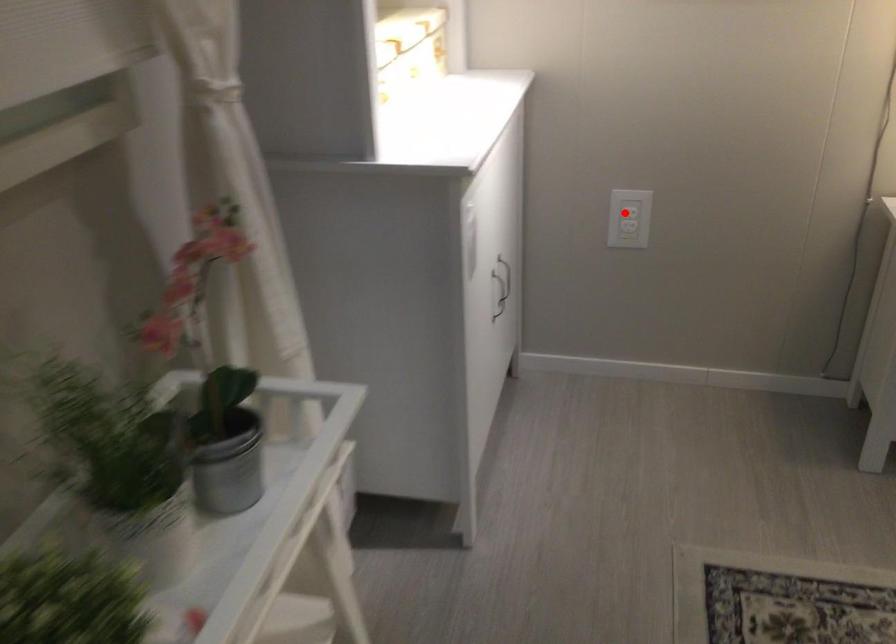
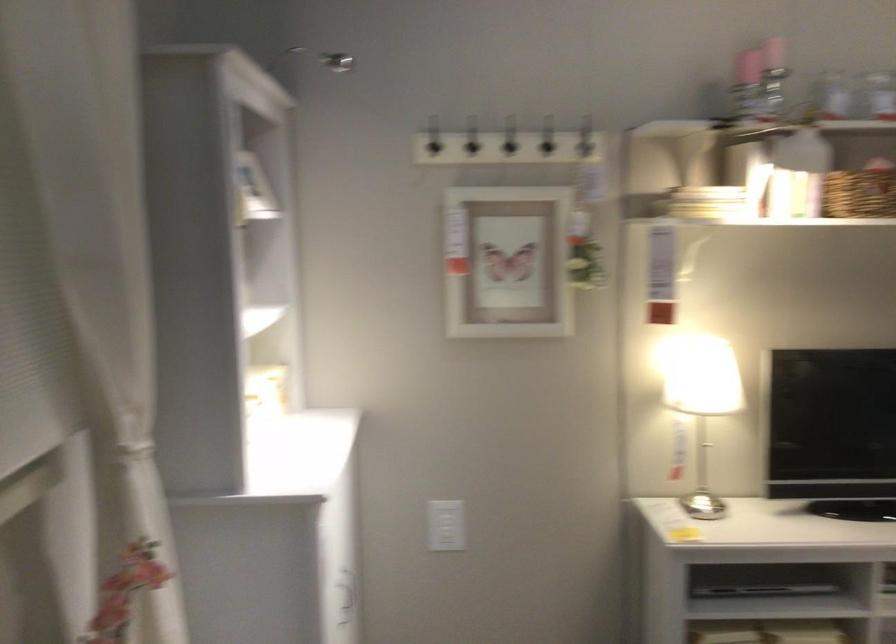
Question: A red point is marked in image1. In image2, is the corresponding 3D point closer to the camera or farther? Reply with the corresponding letter.

Choices:
 (A) The corresponding 3D point is closer.
 (B) The corresponding 3D point is farther.

Answer: (B)